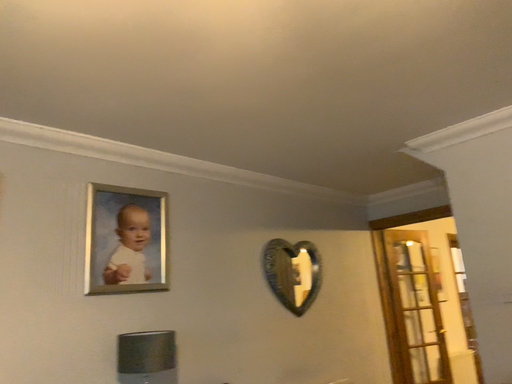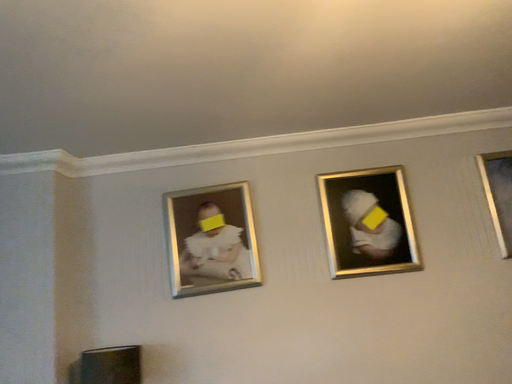
Question: How did the camera likely rotate when shooting the video?

Choices:
 (A) rotated right
 (B) rotated left

Answer: (B)